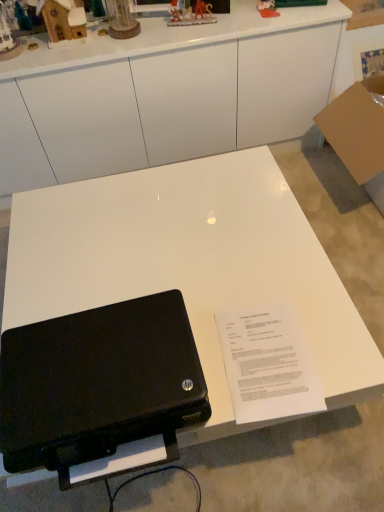
What are the coordinates of `free area in between wooden house at upper left, which is counted as the second toy, starting from the left, and matte wooden clock at upper center, the third toy when ordered from left to right` in the screenshot? It's located at (90, 39).